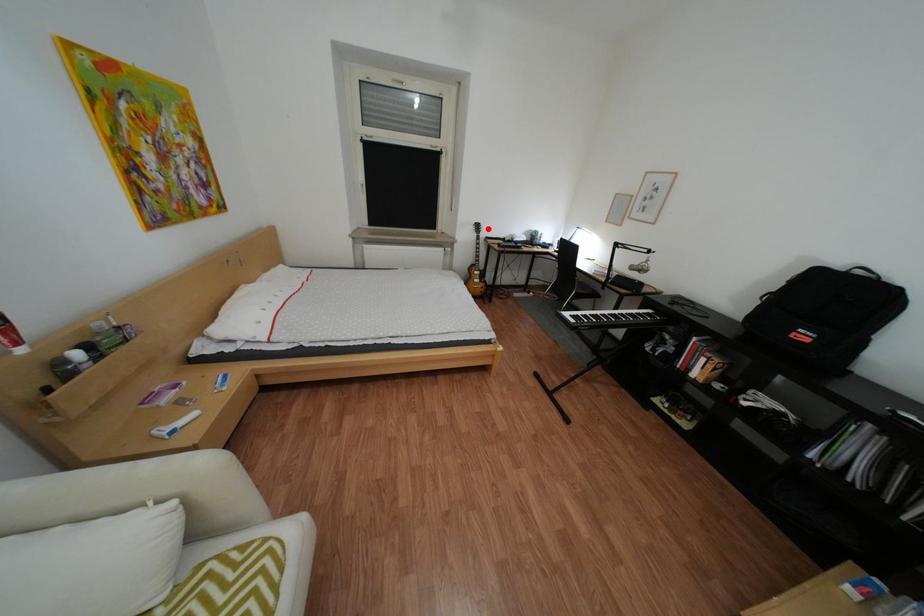
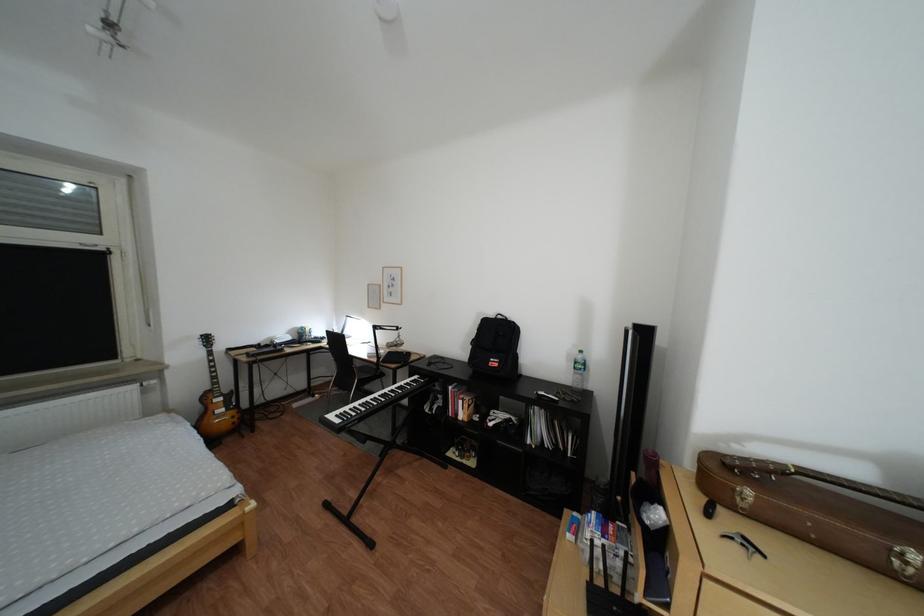
Locate, in the second image, the point that corresponds to the highlighted location in the first image.

(213, 344)